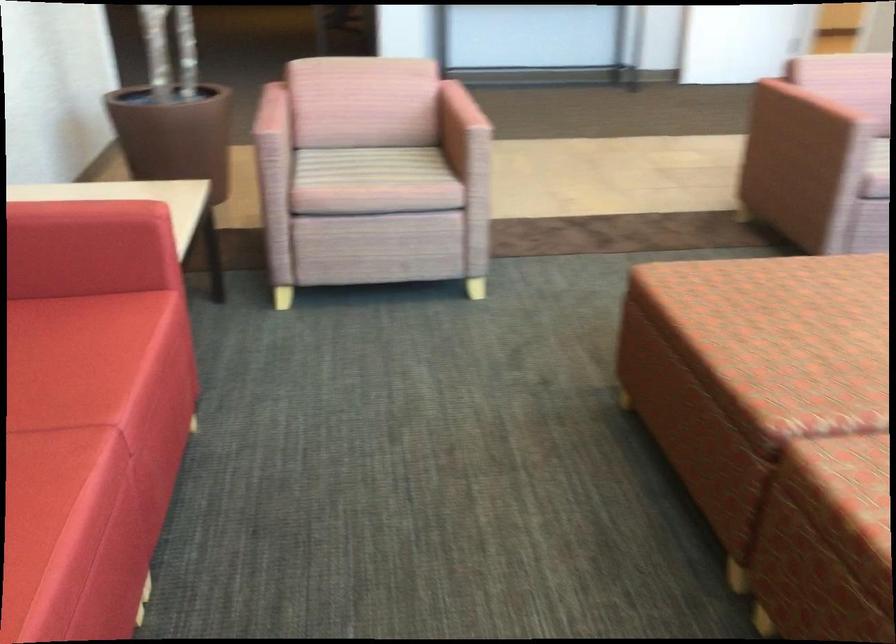
Find the location of a particular element. This screenshot has height=644, width=896. red sofa armrest is located at coordinates (108, 211).